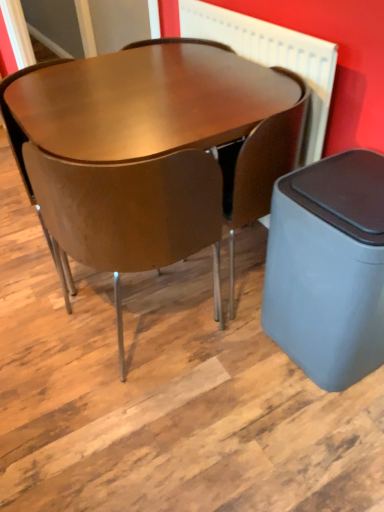
The width and height of the screenshot is (384, 512). Identify the location of free space in front of matte brown chair at center, which ranks as the 1th chair in right-to-left order. (241, 355).